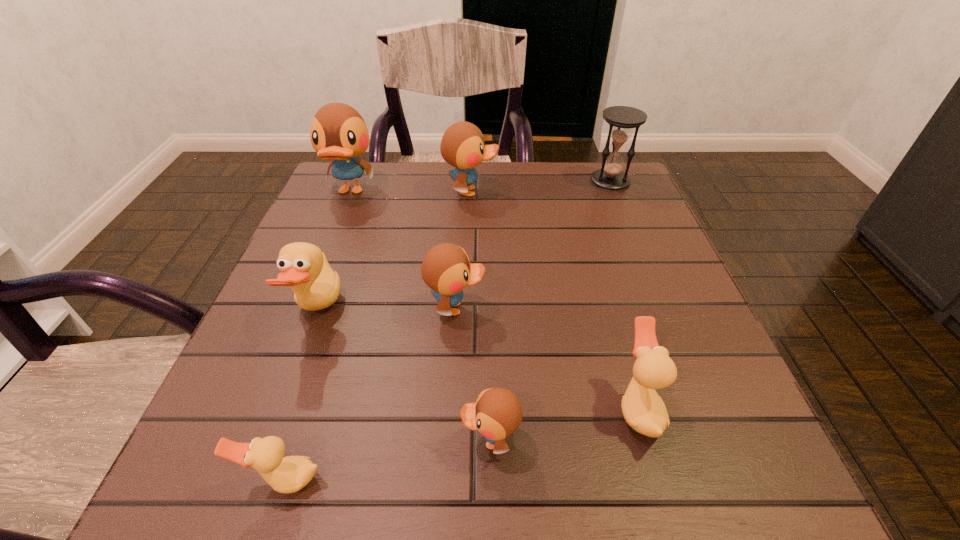
The width and height of the screenshot is (960, 540). In order to click on free space located 0.190m on the front-facing side of the nearest blue duck in this screenshot , I will do `click(330, 440)`.

Identify the location of vacant space located on the front-facing side of the nearest blue duck. The width and height of the screenshot is (960, 540). (226, 440).

Image resolution: width=960 pixels, height=540 pixels. I want to click on hourglass that is positioned at the far edge, so click(x=622, y=119).

Image resolution: width=960 pixels, height=540 pixels. Find the location of `hourglass that is at the right edge`. hourglass that is at the right edge is located at coordinates (622, 119).

The height and width of the screenshot is (540, 960). What are the coordinates of `duck that is at the right edge` in the screenshot? It's located at (643, 409).

Find the location of a particular element. The height and width of the screenshot is (540, 960). object present at the far left corner is located at coordinates (338, 132).

This screenshot has height=540, width=960. I want to click on object that is positioned at the near left corner, so click(290, 474).

This screenshot has height=540, width=960. I want to click on object present at the far right corner, so click(622, 119).

Where is `object positioned at the near right corner`? The image size is (960, 540). object positioned at the near right corner is located at coordinates (643, 409).

The image size is (960, 540). Find the location of `vacant point at the far edge`. vacant point at the far edge is located at coordinates (560, 168).